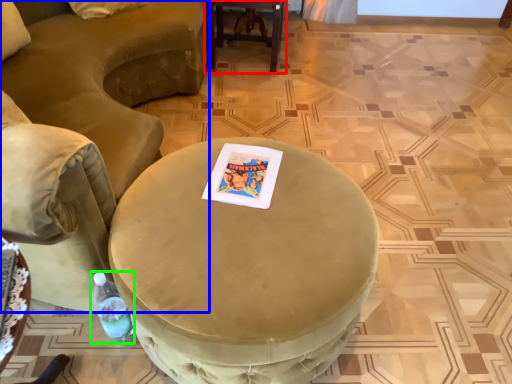
Question: Based on their relative distances, which object is nearer to table (highlighted by a red box)? Choose from chair (highlighted by a blue box) and bottle (highlighted by a green box).

Choices:
 (A) chair
 (B) bottle

Answer: (A)